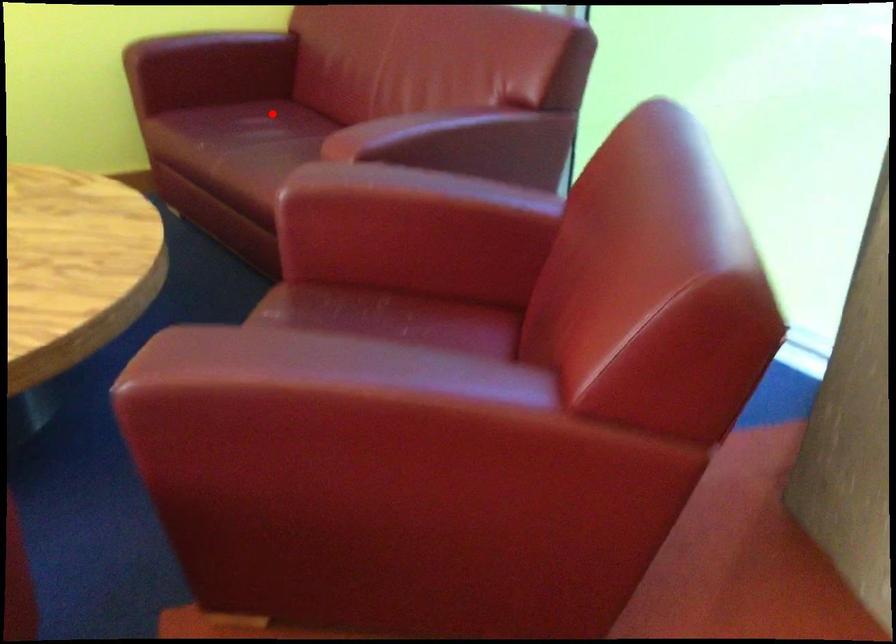
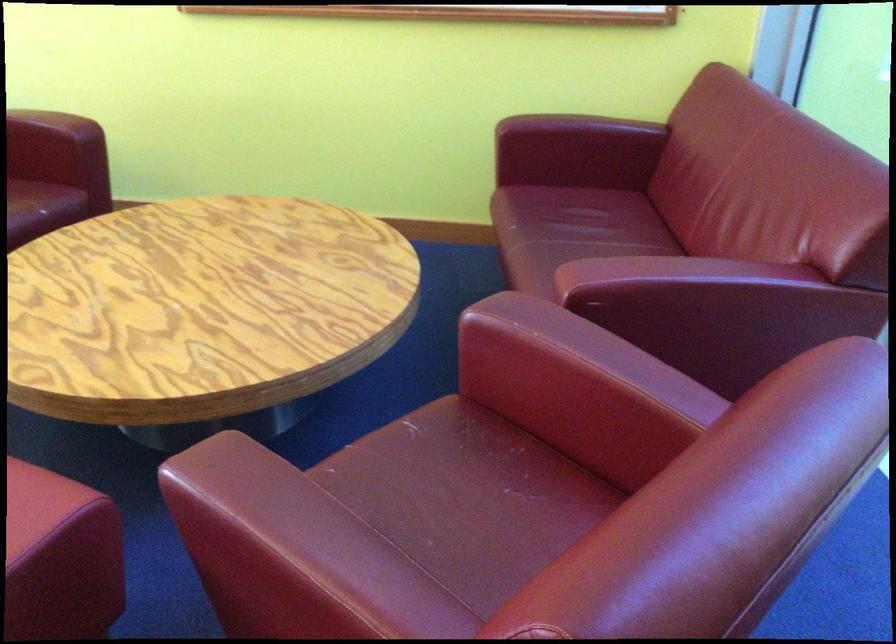
Where in the second image is the point corresponding to the highlighted location from the first image?

(592, 210)